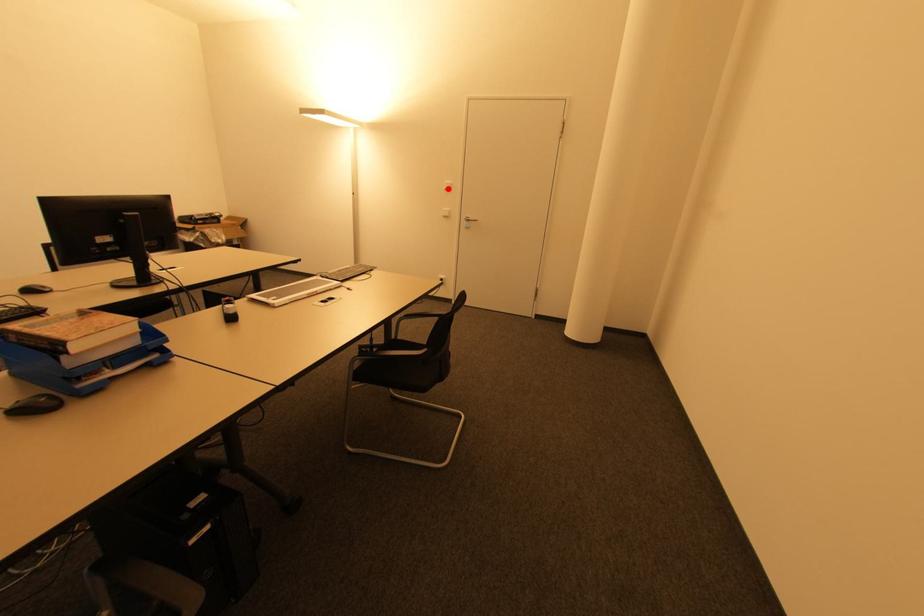
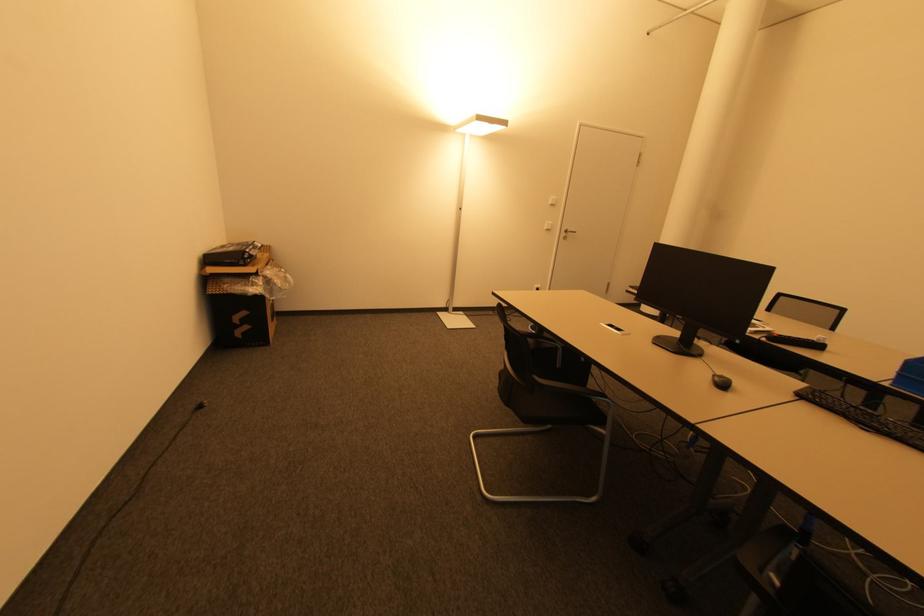
The point at the highlighted location is marked in the first image. Where is the corresponding point in the second image?

(554, 204)